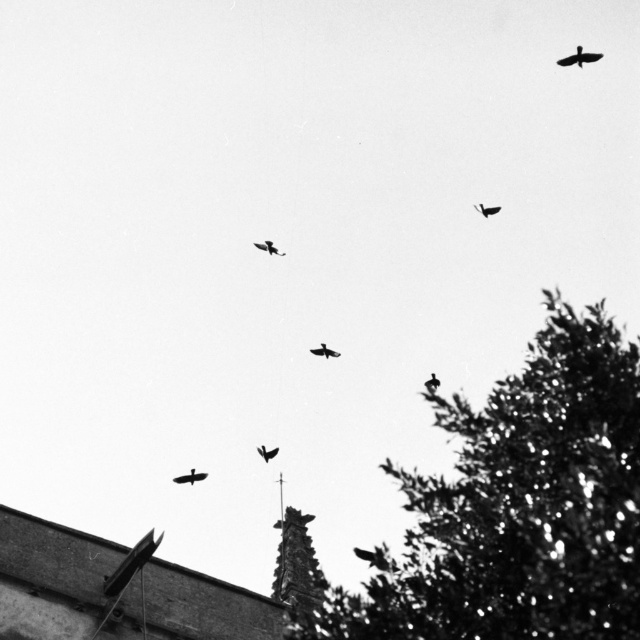
Is black matte bird at center to the left of smooth black bird at upper right from the viewer's perspective?

Yes, black matte bird at center is to the left of smooth black bird at upper right.

Who is more distant from viewer, (259, 451) or (497, 205)?

Point (497, 205)

Between point (275, 451) and point (492, 209), which one is positioned in front?

Point (275, 451)

You are a GUI agent. You are given a task and a screenshot of the screen. Output one action in this format:
    pyautogui.click(x=<x>, y=<y>)
    Task: Click on the black matte bird at center
    Image resolution: width=640 pixels, height=640 pixels.
    Given the screenshot: What is the action you would take?
    pyautogui.click(x=266, y=452)

Which is behind, point (356, 548) or point (432, 372)?

The point (432, 372) is more distant.

Identify the location of silhouette feathered bird at lower right. (372, 557).

Where is `silhouette feathered bird at lower right`? The image size is (640, 640). silhouette feathered bird at lower right is located at coordinates (372, 557).

Identify the location of silhouette feathered bird at lower right. pos(372,557).

Does silhouette feathered bird at lower right appear over silhouette feathered bird at upper center?

Yes.

Who is more forward, (376, 547) or (362, 556)?

Positioned in front is point (362, 556).

Identify the location of silhouette feathered bird at lower right. (x=372, y=557).